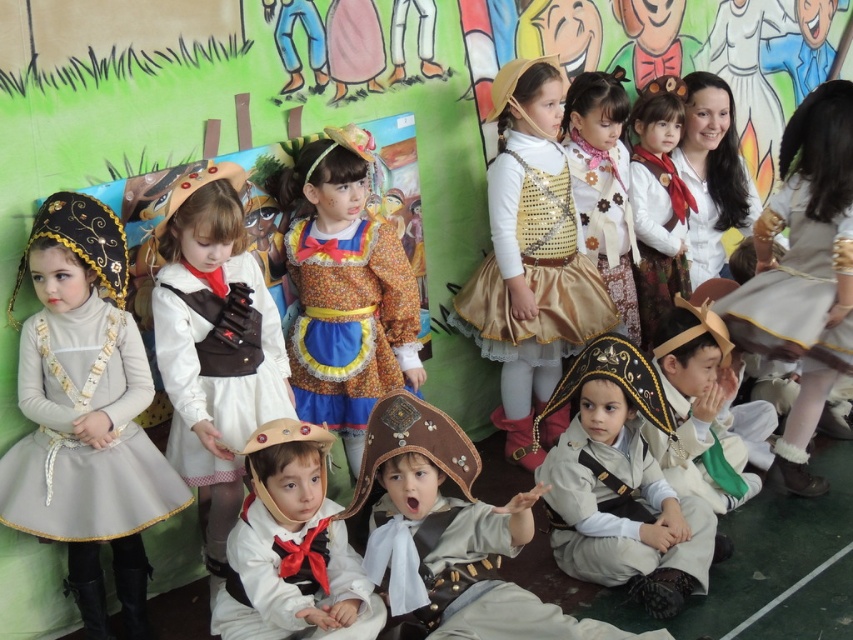
You are a costume designer observing the children in the image. You need to determine which costume component is larger in size between the matte brown pirate hat at center and the white satin dress at center. Which one is larger?

The matte brown pirate hat at center is bigger than the white satin dress at center according to the description.

You are a photographer taking a picture of the matte brown pirate hat at center and the white satin dress at center. Which object will appear larger in the photo?

The matte brown pirate hat at center will appear larger in the photo because it is closer to the viewer than the white satin dress at center.